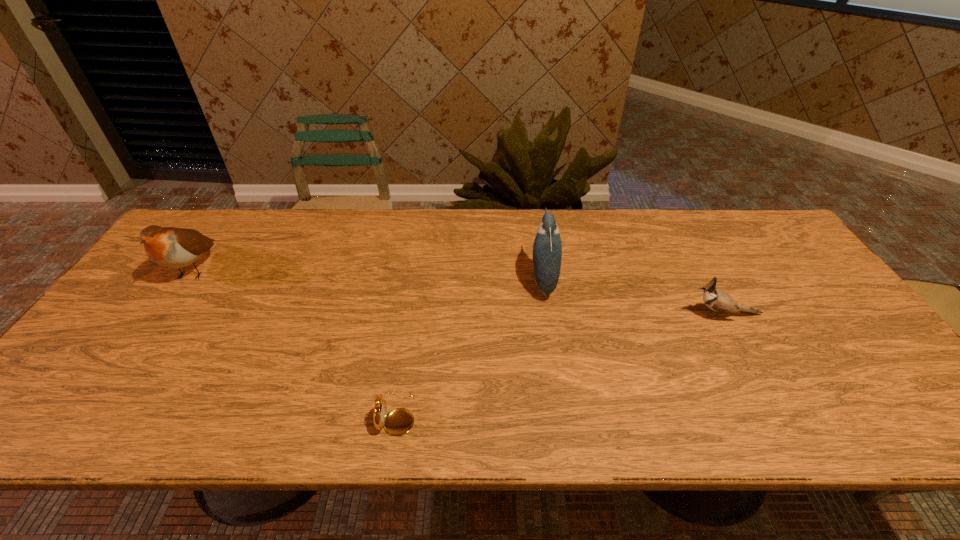
At what (x,y) coordinates should I click in order to perform the action: click on free region at the left edge of the desktop. Please return your answer as a coordinate pair (x, y). Looking at the image, I should click on (155, 322).

At what (x,y) coordinates should I click in order to perform the action: click on vacant space at the right edge. Please return your answer as a coordinate pair (x, y). The image size is (960, 540). Looking at the image, I should click on (795, 311).

The image size is (960, 540). In the image, there is a desktop. In order to click on vacant region at the far right corner in this screenshot , I will do `click(745, 251)`.

Locate an element on the screen. free space between the second object from right to left and the leftmost bird is located at coordinates (369, 274).

This screenshot has height=540, width=960. What are the coordinates of `vacant region between the pocket watch and the nearest bird` in the screenshot? It's located at (560, 364).

Identify the location of empty location between the leftmost bird and the shortest bird. This screenshot has height=540, width=960. (459, 292).

The width and height of the screenshot is (960, 540). I want to click on empty space that is in between the leftmost object and the third object from left to right, so click(369, 274).

Locate an element on the screen. This screenshot has width=960, height=540. vacant region between the nearest object and the leftmost bird is located at coordinates (296, 341).

What are the coordinates of `free spot between the pocket watch and the second object from right to left` in the screenshot? It's located at (469, 347).

What are the coordinates of `free area in between the third object from right to left and the second object from right to left` in the screenshot? It's located at (469, 347).